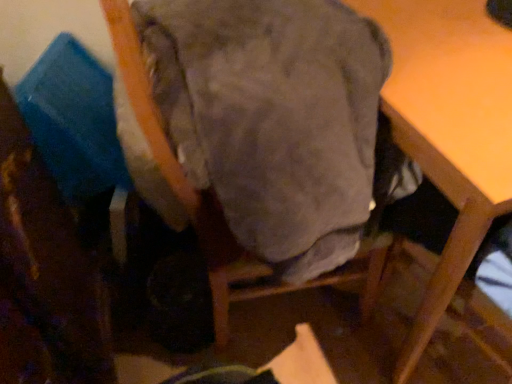
The width and height of the screenshot is (512, 384). In order to click on wooden table at upper right in this screenshot , I will do (449, 128).

What do you see at coordinates (449, 128) in the screenshot?
I see `wooden table at upper right` at bounding box center [449, 128].

The image size is (512, 384). Describe the element at coordinates (253, 126) in the screenshot. I see `velvet-like fabric chair at center` at that location.

Identify the location of velvet-like fabric chair at center. This screenshot has width=512, height=384. (253, 126).

This screenshot has height=384, width=512. I want to click on wooden table at upper right, so click(x=449, y=128).

Considering the positions of objects wooden table at upper right and velvet-like fabric chair at center in the image provided, who is more to the left, wooden table at upper right or velvet-like fabric chair at center?

velvet-like fabric chair at center.

In the scene shown: Is wooden table at upper right in front of or behind velvet-like fabric chair at center in the image?

Clearly, wooden table at upper right is behind velvet-like fabric chair at center.

Is point (426, 11) farther from camera compared to point (255, 122)?

Yes, it is behind point (255, 122).

From the image's perspective, which is below, wooden table at upper right or velvet-like fabric chair at center?

velvet-like fabric chair at center appears lower in the image.

In the scene shown: From a real-world perspective, which is physically below, wooden table at upper right or velvet-like fabric chair at center?

From a 3D spatial view, wooden table at upper right is below.

Which object is thinner, wooden table at upper right or velvet-like fabric chair at center?

Thinner between the two is velvet-like fabric chair at center.

Considering the relative sizes of wooden table at upper right and velvet-like fabric chair at center in the image provided, is wooden table at upper right shorter than velvet-like fabric chair at center?

Indeed, wooden table at upper right has a lesser height compared to velvet-like fabric chair at center.

Considering the sizes of wooden table at upper right and velvet-like fabric chair at center in the image, is wooden table at upper right bigger or smaller than velvet-like fabric chair at center?

wooden table at upper right is bigger than velvet-like fabric chair at center.

Is wooden table at upper right outside of velvet-like fabric chair at center?

That's correct, wooden table at upper right is outside of velvet-like fabric chair at center.

Is there a large distance between wooden table at upper right and velvet-like fabric chair at center?

Result: No, wooden table at upper right is not far away from velvet-like fabric chair at center.

Is wooden table at upper right facing towards velvet-like fabric chair at center?

No, wooden table at upper right is not facing towards velvet-like fabric chair at center.

What's the angular difference between wooden table at upper right and velvet-like fabric chair at center's facing directions?

The angle between the facing direction of wooden table at upper right and the facing direction of velvet-like fabric chair at center is 86.3 degrees.

At what (x,y) coordinates should I click in order to perform the action: click on table below the velvet-like fabric chair at center (from a real-world perspective). Please return your answer as a coordinate pair (x, y). Looking at the image, I should click on (449, 128).

Is velvet-like fabric chair at center at the left side of wooden table at upper right?

Yes.

Looking at this image, is velvet-like fabric chair at center behind wooden table at upper right?

No.

Is point (165, 88) more distant than point (460, 224)?

No, (165, 88) is closer to viewer.

From the picture: From the image's perspective, is velvet-like fabric chair at center above or below wooden table at upper right?

Clearly, from the image's perspective, velvet-like fabric chair at center is below wooden table at upper right.

From a real-world perspective, relative to wooden table at upper right, is velvet-like fabric chair at center vertically above or below?

velvet-like fabric chair at center is situated higher than wooden table at upper right in the real world.

Considering the relative sizes of velvet-like fabric chair at center and wooden table at upper right in the image provided, is velvet-like fabric chair at center thinner than wooden table at upper right?

Yes.

Considering the sizes of velvet-like fabric chair at center and wooden table at upper right in the image, is velvet-like fabric chair at center taller or shorter than wooden table at upper right?

Considering their sizes, velvet-like fabric chair at center has more height than wooden table at upper right.

Looking at the image, does velvet-like fabric chair at center seem bigger or smaller compared to wooden table at upper right?

In the image, velvet-like fabric chair at center appears to be smaller than wooden table at upper right.

Is velvet-like fabric chair at center inside the boundaries of wooden table at upper right, or outside?

velvet-like fabric chair at center is outside wooden table at upper right.

Is the surface of velvet-like fabric chair at center in direct contact with wooden table at upper right?

velvet-like fabric chair at center and wooden table at upper right are clearly separated.

Is velvet-like fabric chair at center facing towards wooden table at upper right?

Yes, velvet-like fabric chair at center faces towards wooden table at upper right.

How different are the orientations of velvet-like fabric chair at center and wooden table at upper right in degrees?

86.3 degrees separate the facing orientations of velvet-like fabric chair at center and wooden table at upper right.

Identify the location of chair that is below the wooden table at upper right (from the image's perspective). This screenshot has width=512, height=384. (253, 126).

Where is `table on the right of velvet-like fabric chair at center`? The height and width of the screenshot is (384, 512). table on the right of velvet-like fabric chair at center is located at coordinates (449, 128).

The image size is (512, 384). I want to click on chair above the wooden table at upper right (from a real-world perspective), so click(x=253, y=126).